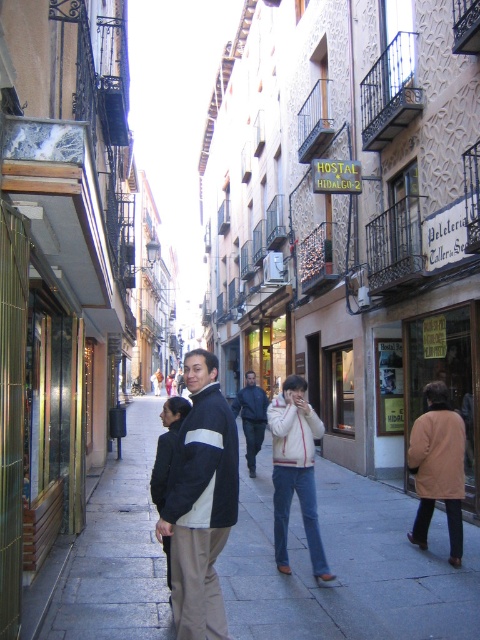
Question: Among these points, which one is nearest to the camera?

Choices:
 (A) 251,413
 (B) 196,572

Answer: (B)

Question: Can you confirm if smooth concrete sidewalk at center is smaller than dark blue jacket at center?

Choices:
 (A) yes
 (B) no

Answer: (B)

Question: Is black jacket at center bigger than dark blue jacket at center?

Choices:
 (A) no
 (B) yes

Answer: (B)

Question: Which point is closer to the camera?

Choices:
 (A) dark blue jacket at center
 (B) smooth concrete sidewalk at center
 (C) black jacket at center

Answer: (C)

Question: Does smooth concrete sidewalk at center appear over black jacket at center?

Choices:
 (A) no
 (B) yes

Answer: (A)

Question: Which of the following is the farthest from the observer?

Choices:
 (A) smooth concrete sidewalk at center
 (B) black jacket at center
 (C) dark blue jacket at center

Answer: (C)